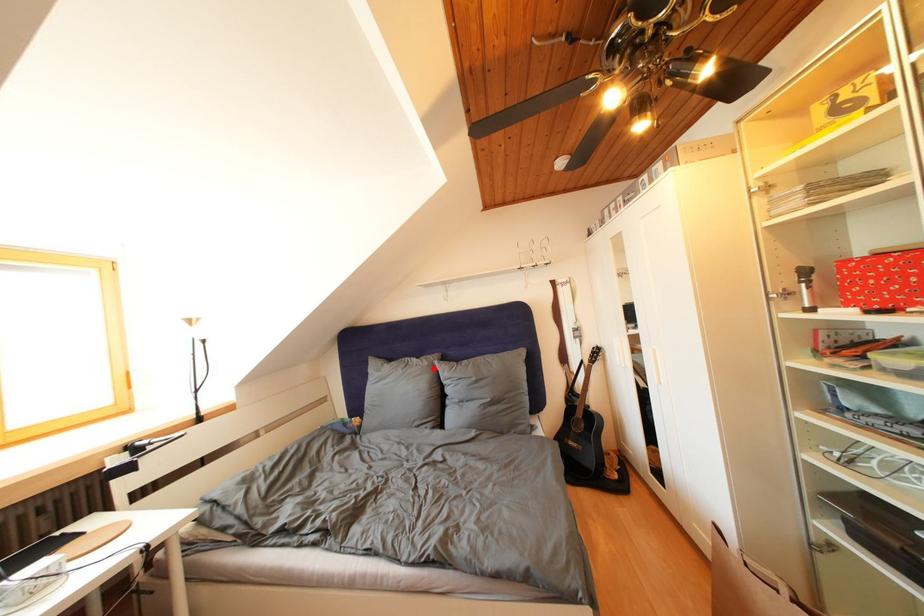
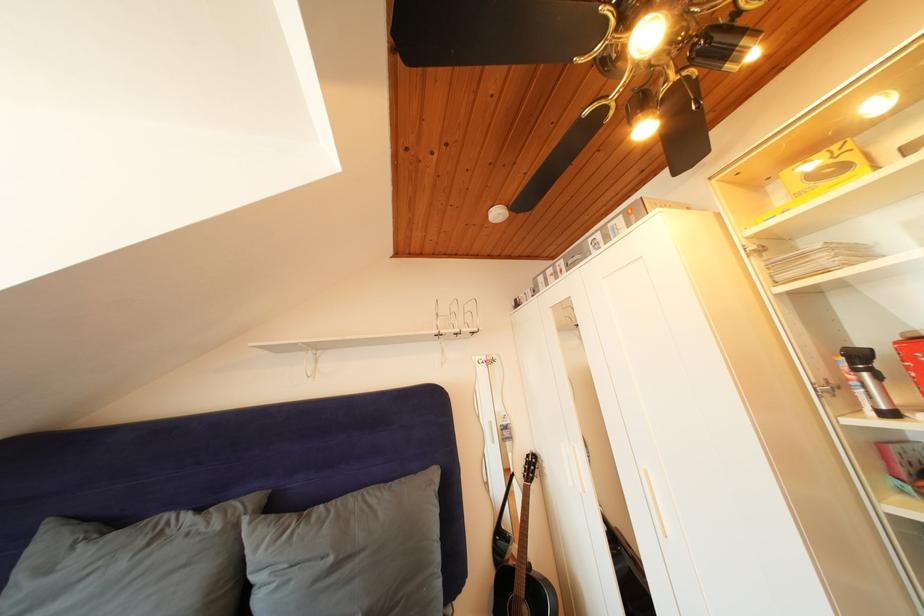
Locate, in the second image, the point that corresponds to the highlighted location in the first image.

(225, 531)